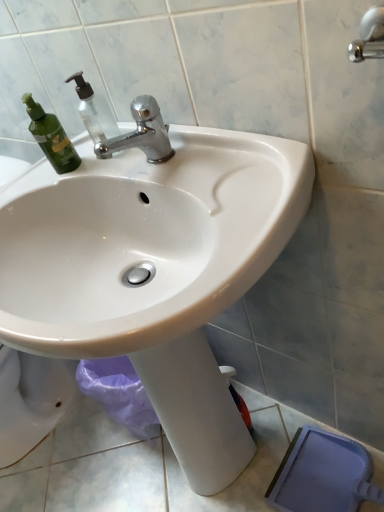
Question: Would you say transparent plastic soap dispenser at upper left is to the left or to the right of white glossy sink at center in the picture?

Choices:
 (A) left
 (B) right

Answer: (A)

Question: From their relative heights in the image, would you say transparent plastic soap dispenser at upper left is taller or shorter than white glossy sink at center?

Choices:
 (A) tall
 (B) short

Answer: (B)

Question: Estimate the real-world distances between objects in this image. Which object is closer to the white glossy sink at center?

Choices:
 (A) transparent plastic soap dispenser at upper left
 (B) polished chrome faucet at upper center

Answer: (B)

Question: Estimate the real-world distances between objects in this image. Which object is farther from the polished chrome faucet at upper center?

Choices:
 (A) transparent plastic soap dispenser at upper left
 (B) white glossy sink at center

Answer: (B)